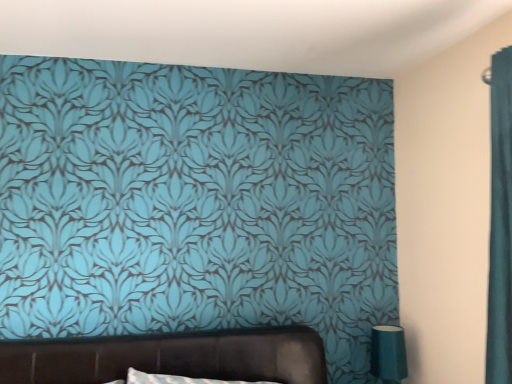
Question: In the image, is teal glossy table lamp at lower right positioned in front of or behind brown leather bed at center?

Choices:
 (A) front
 (B) behind

Answer: (B)

Question: Is point (386, 367) positioned closer to the camera than point (73, 355)?

Choices:
 (A) closer
 (B) farther

Answer: (B)

Question: Would you say teal glossy table lamp at lower right is to the left or to the right of brown leather bed at center in the picture?

Choices:
 (A) right
 (B) left

Answer: (A)

Question: Considering the positions of brown leather bed at center and teal glossy table lamp at lower right in the image, is brown leather bed at center wider or thinner than teal glossy table lamp at lower right?

Choices:
 (A) wide
 (B) thin

Answer: (A)

Question: In terms of height, does brown leather bed at center look taller or shorter compared to teal glossy table lamp at lower right?

Choices:
 (A) short
 (B) tall

Answer: (B)

Question: In the image, is brown leather bed at center on the left side or the right side of teal glossy table lamp at lower right?

Choices:
 (A) left
 (B) right

Answer: (A)

Question: Relative to teal glossy table lamp at lower right, is brown leather bed at center in front or behind?

Choices:
 (A) behind
 (B) front

Answer: (B)